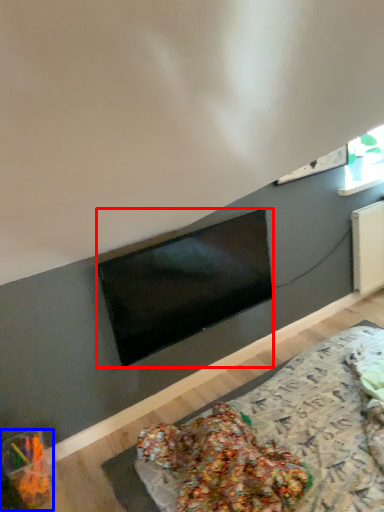
Question: Which object appears farthest to the camera in this image, television (highlighted by a red box) or food (highlighted by a blue box)?

Choices:
 (A) television
 (B) food

Answer: (A)